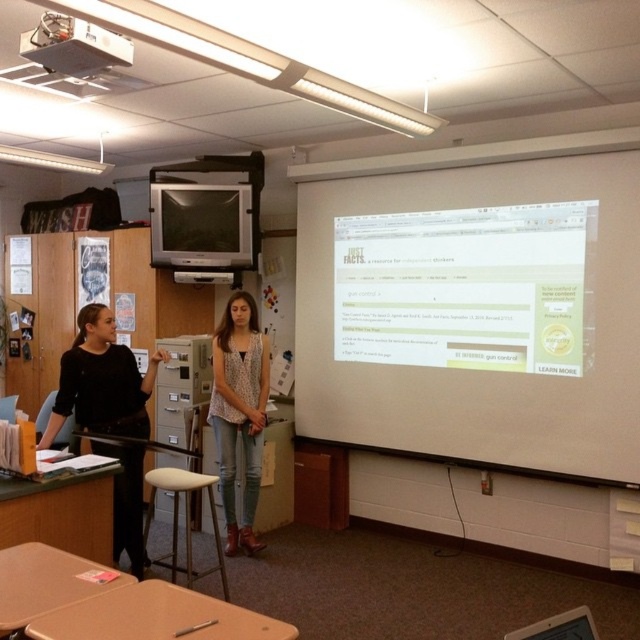
Does white matte projection screen at center have a greater width compared to black fabric shirt at left?

Yes.

Between white matte projection screen at center and black fabric shirt at left, which one is positioned higher?

white matte projection screen at center

Where is `white matte projection screen at center`? white matte projection screen at center is located at coordinates click(x=484, y=321).

Does denim jeans at center have a smaller size compared to white plastic projector at upper left?

Incorrect, denim jeans at center is not smaller in size than white plastic projector at upper left.

Which is in front, point (243, 536) or point (58, 51)?

Point (58, 51)

At what (x,y) coordinates should I click in order to perform the action: click on denim jeans at center. Please return your answer as a coordinate pair (x, y). Image resolution: width=640 pixels, height=640 pixels. Looking at the image, I should click on (240, 412).

Does black fabric shirt at left lie behind white plastic projector at upper left?

A: That is True.

Locate an element on the screen. black fabric shirt at left is located at coordinates (100, 381).

You are a GUI agent. You are given a task and a screenshot of the screen. Output one action in this format:
    pyautogui.click(x=<x>, y=<y>)
    Task: Click on the black fabric shirt at left
    This screenshot has width=640, height=640.
    Given the screenshot: What is the action you would take?
    pyautogui.click(x=100, y=381)